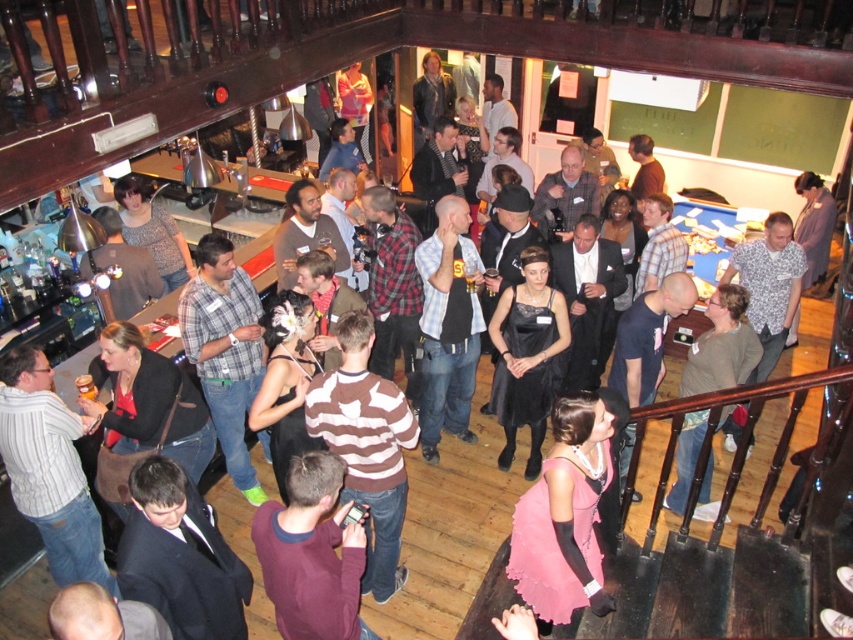
Question: Considering the real-world distances, which object is farthest from the black satin dress at center?

Choices:
 (A) checkered fabric shirt at center
 (B) pink satin dress at center

Answer: (B)

Question: Does pink satin dress at center appear on the left side of checkered fabric shirt at center?

Choices:
 (A) no
 (B) yes

Answer: (A)

Question: Is checkered fabric shirt at center further to the viewer compared to black satin dress at center?

Choices:
 (A) no
 (B) yes

Answer: (B)

Question: Which point appears farthest from the camera in this image?

Choices:
 (A) (587, 564)
 (B) (434, 420)
 (C) (544, 292)

Answer: (B)

Question: Does pink satin dress at center lie in front of black satin dress at center?

Choices:
 (A) no
 (B) yes

Answer: (B)

Question: Which point appears closest to the camera in this image?

Choices:
 (A) (467, 380)
 (B) (585, 435)

Answer: (B)